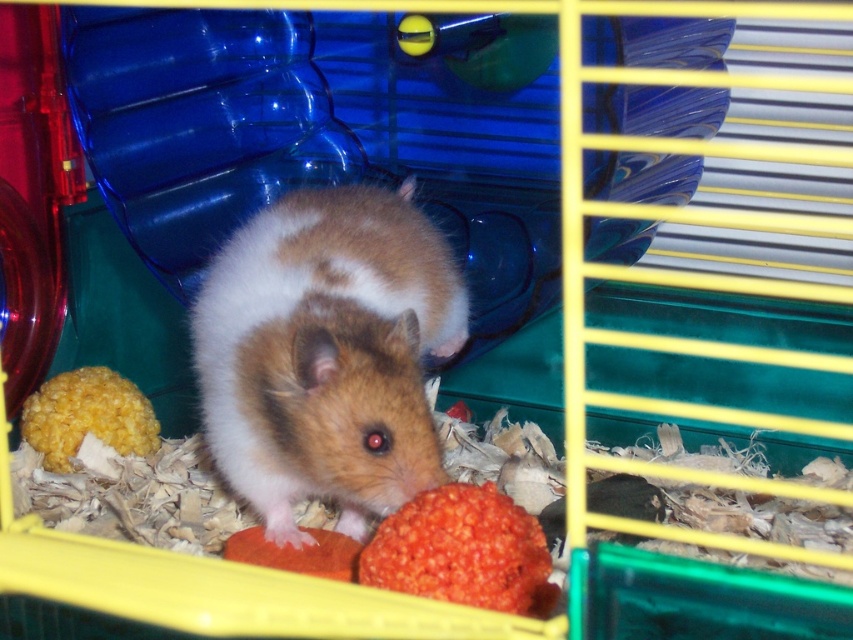
Question: Considering the real-world distances, which object is closest to the brown fuzzy hamster at center?

Choices:
 (A) orange textured ball at center
 (B) yellow crumbly food at lower left

Answer: (A)

Question: Among these objects, which one is nearest to the camera?

Choices:
 (A) orange textured ball at center
 (B) yellow crumbly food at lower left
 (C) brown fuzzy hamster at center

Answer: (A)

Question: Which point is farther to the camera?

Choices:
 (A) brown fuzzy hamster at center
 (B) yellow crumbly food at lower left
 (C) orange textured ball at center

Answer: (B)

Question: Is brown fuzzy hamster at center to the left of orange textured ball at center from the viewer's perspective?

Choices:
 (A) yes
 (B) no

Answer: (A)

Question: Is orange textured ball at center closer to the viewer compared to yellow crumbly food at lower left?

Choices:
 (A) no
 (B) yes

Answer: (B)

Question: Can you confirm if brown fuzzy hamster at center is positioned below yellow crumbly food at lower left?

Choices:
 (A) yes
 (B) no

Answer: (B)